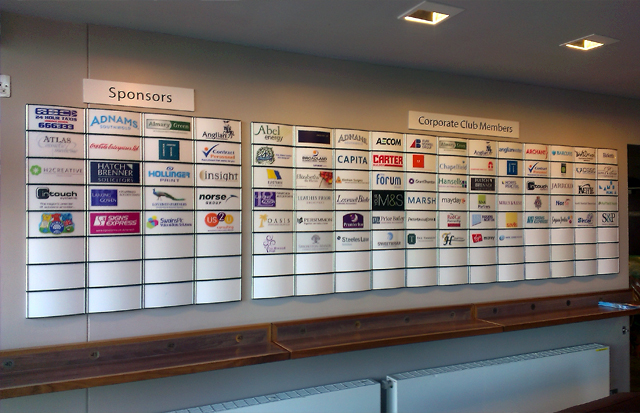
Locate an element on the screen. This screenshot has width=640, height=413. ceiling lights is located at coordinates (425, 28), (588, 54).